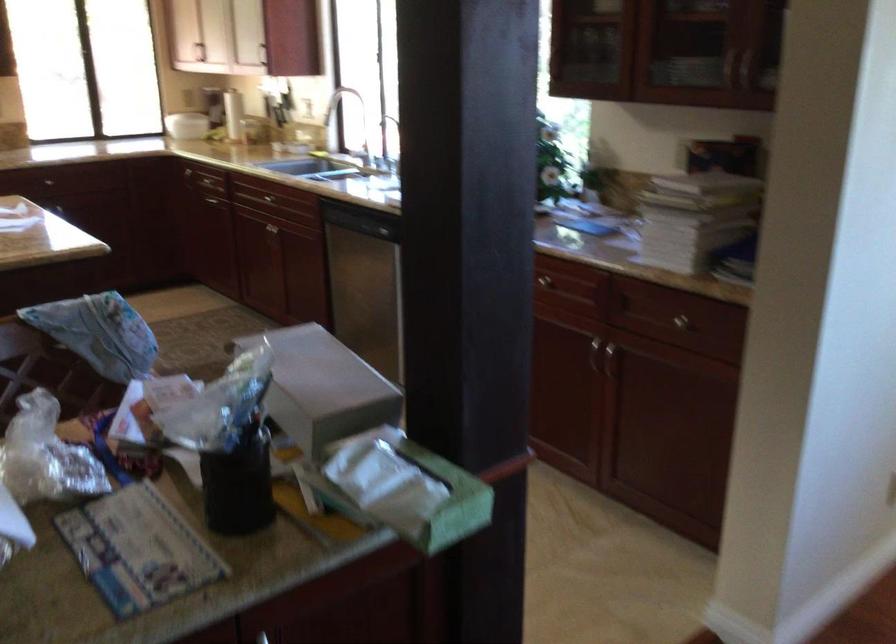
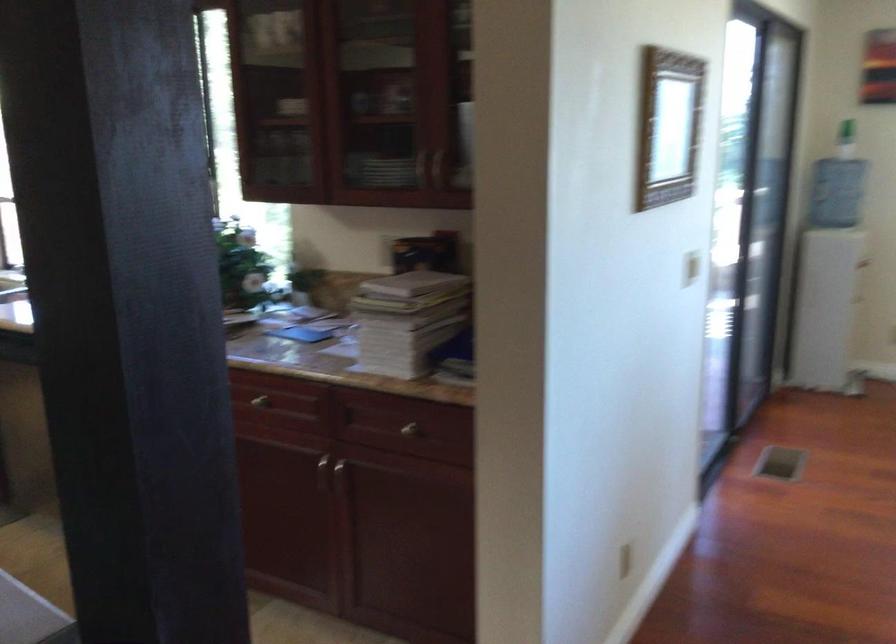
Question: What movement of the cameraman would produce the second image?

Choices:
 (A) Left
 (B) Right
 (C) Forward
 (D) Backward

Answer: (C)